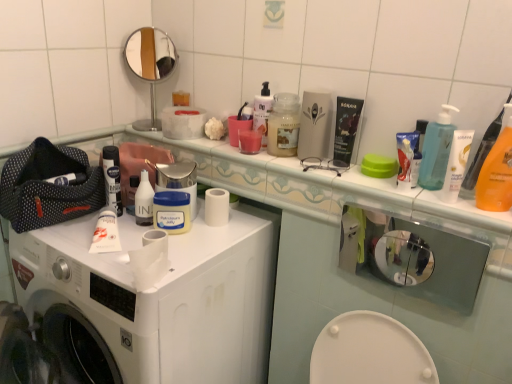
The height and width of the screenshot is (384, 512). What are the coordinates of `vacant area that lies to the right of white glossy bottle at center, which appears as the 4th mouthwash when viewed from the right` in the screenshot? It's located at (211, 237).